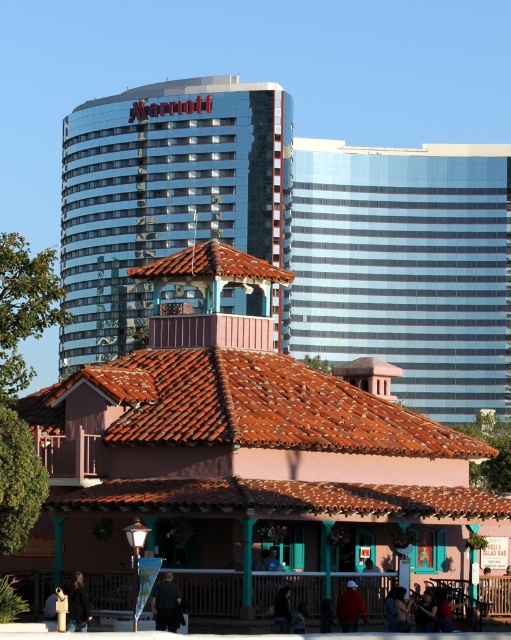
Question: Which of the following is the closest to the observer?

Choices:
 (A) (379, 220)
 (B) (132, 305)

Answer: (B)

Question: Which object is positioned farthest from the glassy blue skyscraper at upper right?

Choices:
 (A) glassy blue skyscraper at upper center
 (B) matte teal tower at center

Answer: (B)

Question: Can you confirm if matte teal tower at center is smaller than glassy blue skyscraper at upper right?

Choices:
 (A) yes
 (B) no

Answer: (A)

Question: From the image, what is the correct spatial relationship of matte teal tower at center in relation to glassy blue skyscraper at upper right?

Choices:
 (A) above
 (B) below

Answer: (B)

Question: Is matte teal tower at center below glassy blue skyscraper at upper right?

Choices:
 (A) no
 (B) yes

Answer: (B)

Question: Which point is farther from the camera taking this photo?

Choices:
 (A) (127, 147)
 (B) (301, 259)
 (C) (128, 452)

Answer: (A)